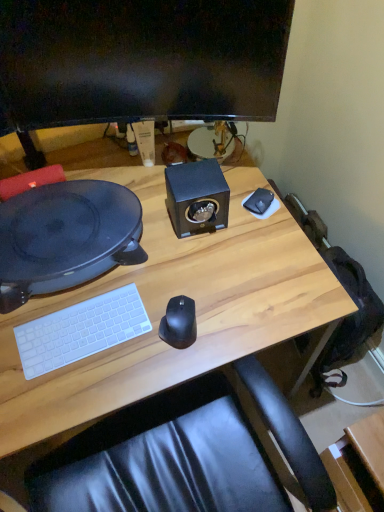
Find the location of a particular element. The image size is (384, 512). free point in front of white matte keyboard at lower left is located at coordinates (70, 391).